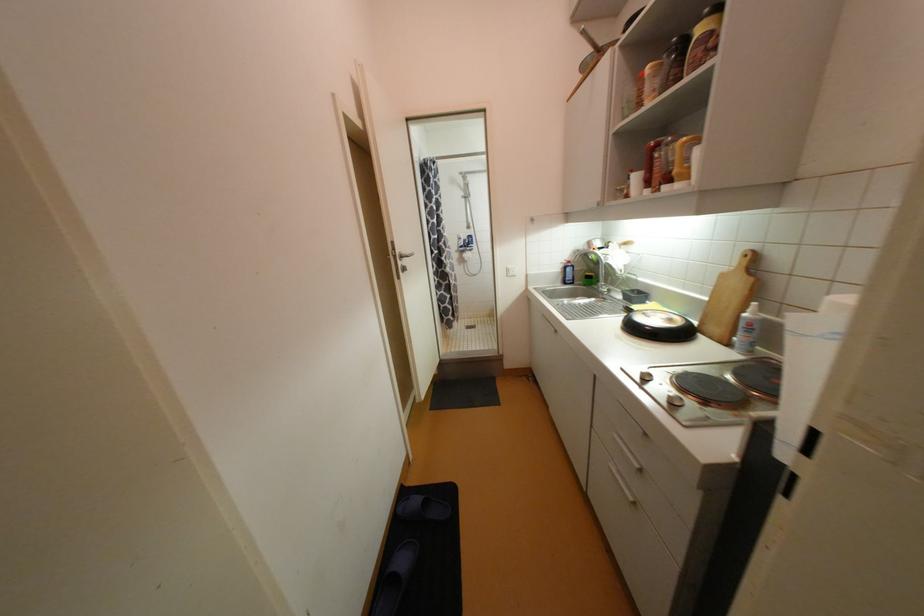
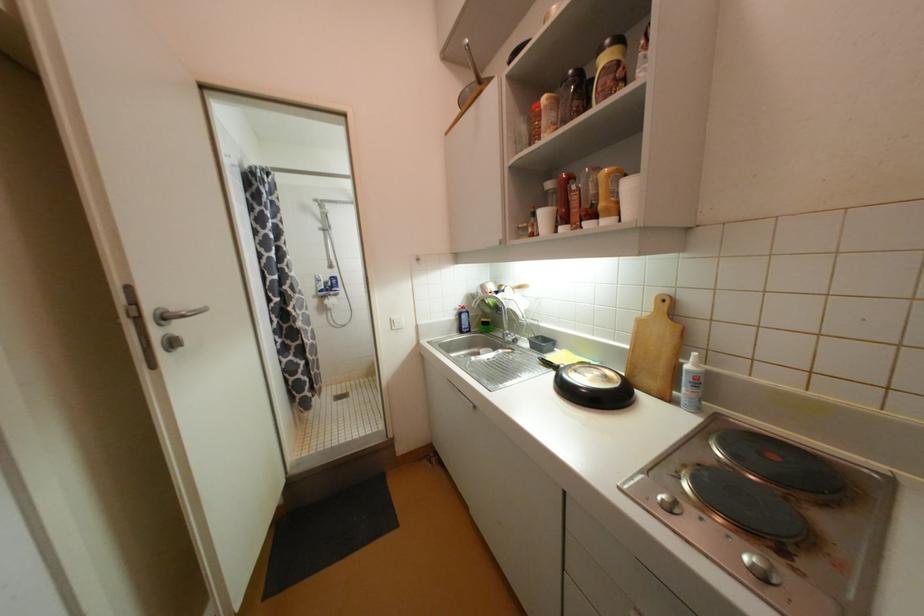
In the second image, find the point that corresponds to [597,51] in the first image.

(479, 79)